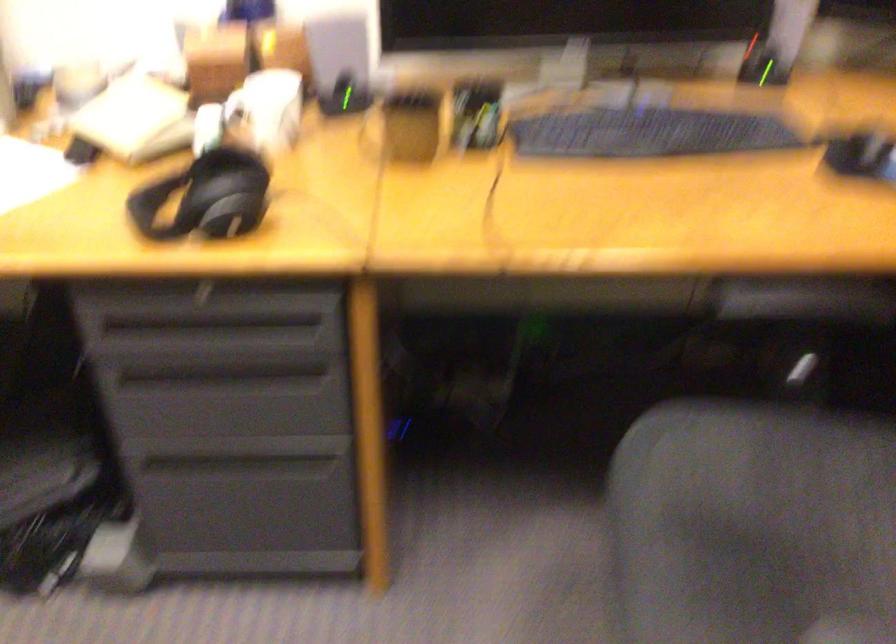
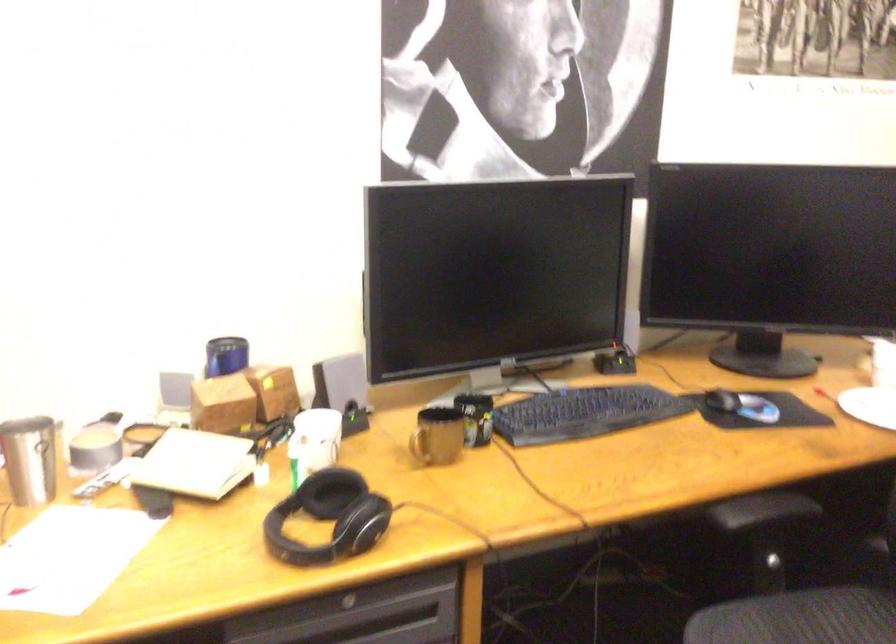
In the second image, find the point that corresponds to point (231, 201) in the first image.

(329, 518)